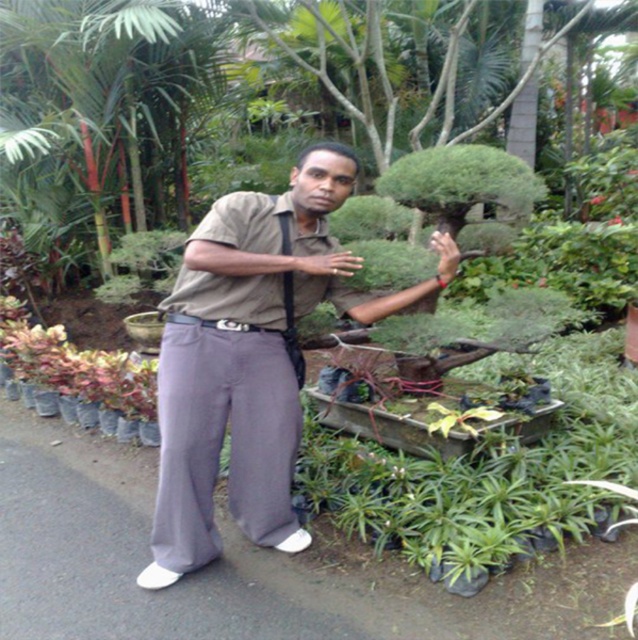
You are a photographer trying to capture a clear shot of the green leafy plant at center. The matte khaki shirt at center is blocking your view. Can you estimate whether the shirt is wider than the plant to determine if moving it might help?

The matte khaki shirt at center might be wider than green leafy plant at center, so moving it could potentially improve the view of the green leafy plant at center.

You are a drone operator trying to navigate between two points in the garden. You need to fly from point A to point B. Given that point A is at coordinates point (204, 358) and point B is at coordinates point (634, 177), which point is closer to the man standing in the garden?

Point (204, 358) is in front of point (634, 177), so it is closer to the man standing in the garden.

You are a gardener who needs to water the green matte flower at center and the red matte flower at upper center. Since you can only reach 1.5 meters, which flower should you water first to avoid having to move the other one?

You should water the red matte flower at upper center first because it is behind the green matte flower at center. Since you can only reach 1.5 meters, watering the one behind first might require moving the front flower to reach it, but since it is already behind, you can access it without moving the green one first.